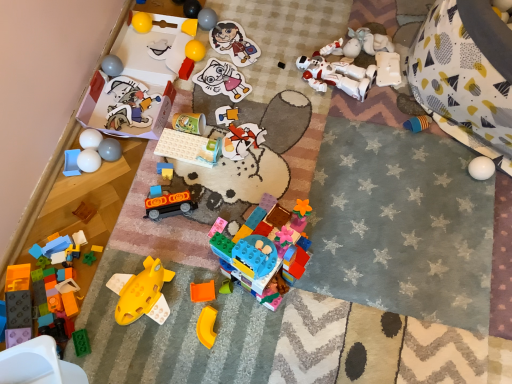
Locate an element on the screen. free space between yellow rubber ball at upper center, the tenth toy from the right, and yellow matte plastic piece at center, the seventeenth toy viewed from the left is located at coordinates (200, 175).